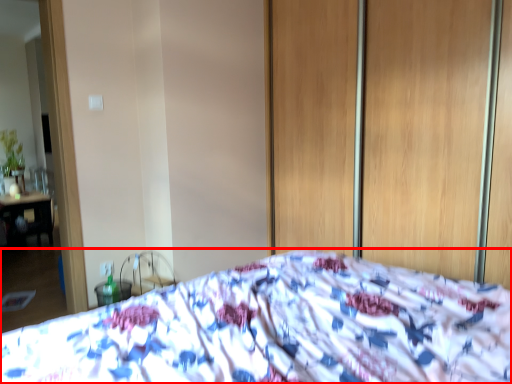
Question: Considering the relative positions of bed (annotated by the red box) and screen door in the image provided, where is bed (annotated by the red box) located with respect to the staircase?

Choices:
 (A) right
 (B) left

Answer: (B)